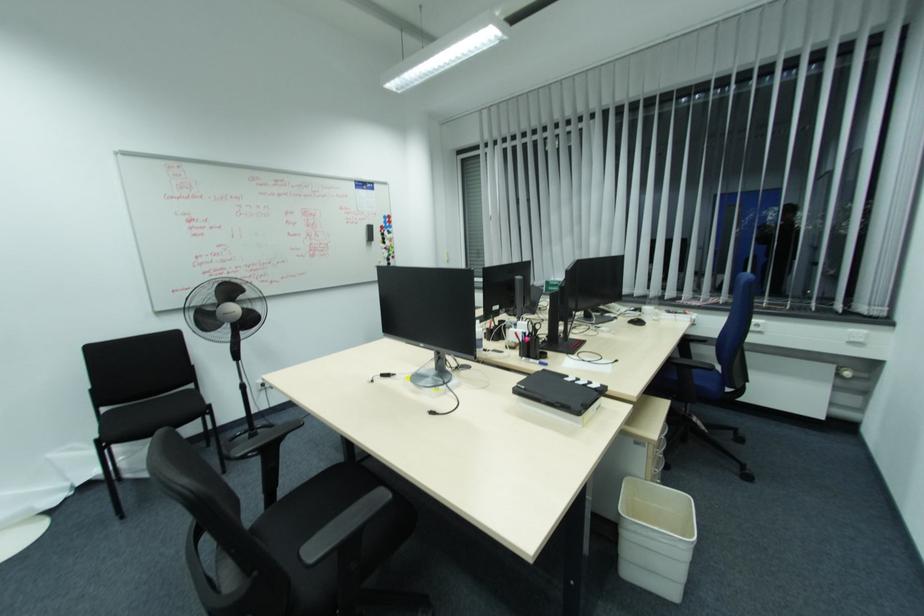
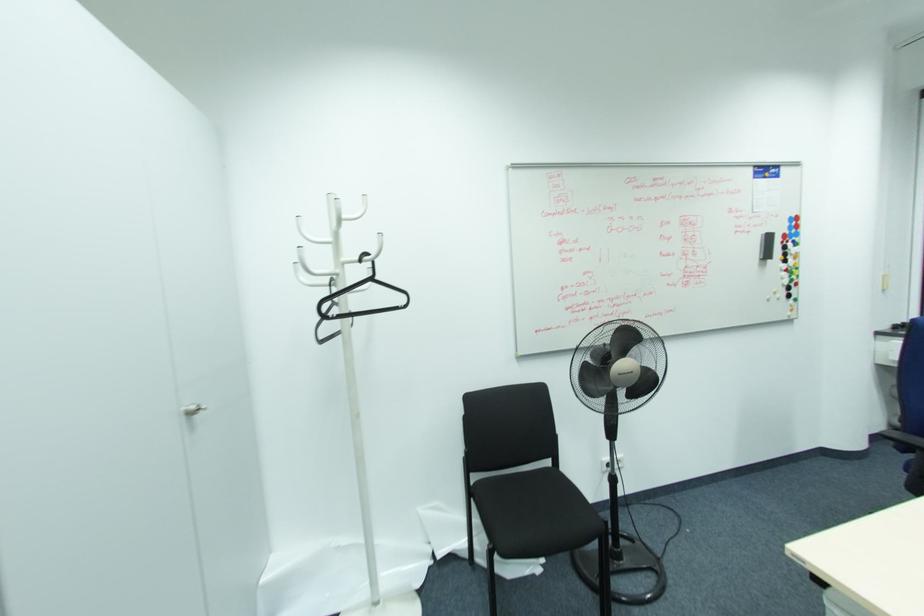
Where in the second image is the point corresponding to pixel 383 235 from the first image?

(785, 248)